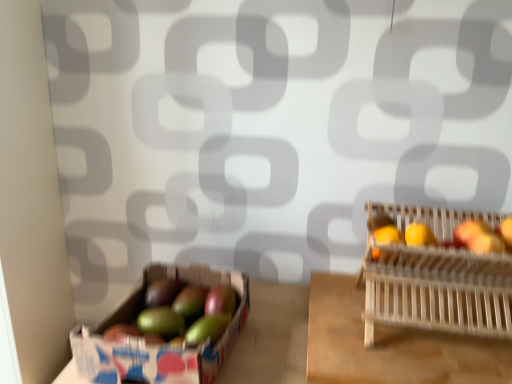
At what (x,y) coordinates should I click in order to perform the action: click on free spot to the right of green matte avocado at lower left, arranged as the first apple when viewed from the left. Please return your answer as a coordinate pair (x, y). This screenshot has width=512, height=384. Looking at the image, I should click on (253, 326).